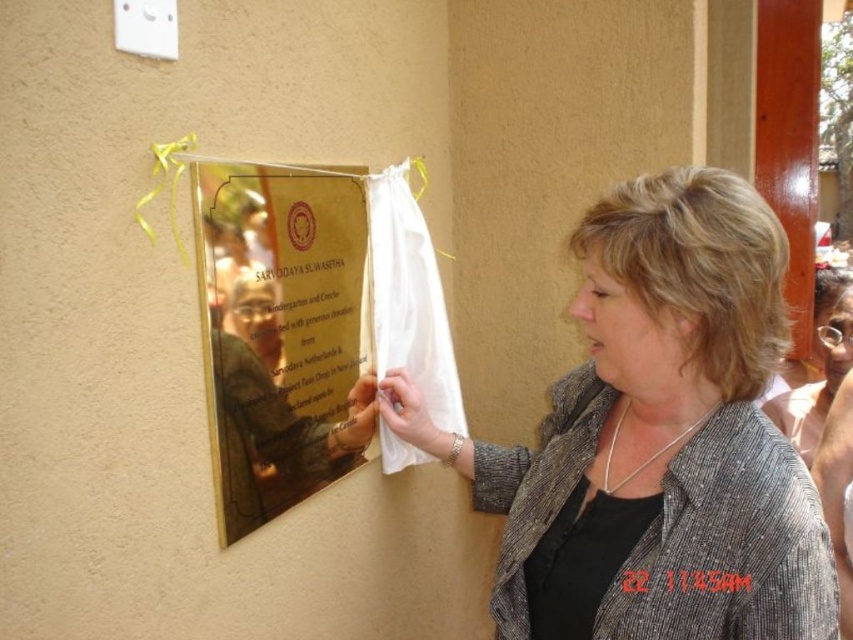
You are standing in the room and want to move from the point at coordinates point (x=579, y=563) to the point at coordinates point (x=326, y=186). Which direction should you move to get closer to your destination?

To move from point (x=579, y=563) to point (x=326, y=186), you should move towards the left and downward since point (x=326, y=186) is located to the left and lower than point (x=579, y=563).

Looking at this image, you are a tailor measuring fabrics for alterations. You have a piece of fabric that can cover either the gray textured blazer at center or the gold polished metal plaque at upper left. Which object requires a larger piece of fabric?

The gray textured blazer at center requires a larger piece of fabric since it is bigger than the gold polished metal plaque at upper left.

You are an interior designer assessing the space in the image. You need to determine if the gray textured blazer at center can be placed on a shelf that can only hold items narrower than the gold polished metal plaque at upper left. Can the blazer fit?

The gray textured blazer at center is wider than the gold polished metal plaque at upper left, so it cannot fit on the shelf designed for items narrower than the plaque.